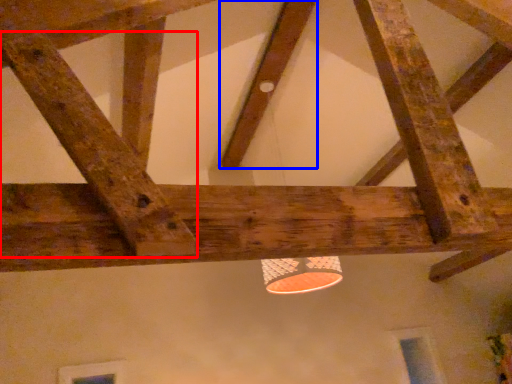
Question: Among these objects, which one is farthest to the camera, plank (highlighted by a red box) or plank (highlighted by a blue box)?

Choices:
 (A) plank
 (B) plank

Answer: (B)